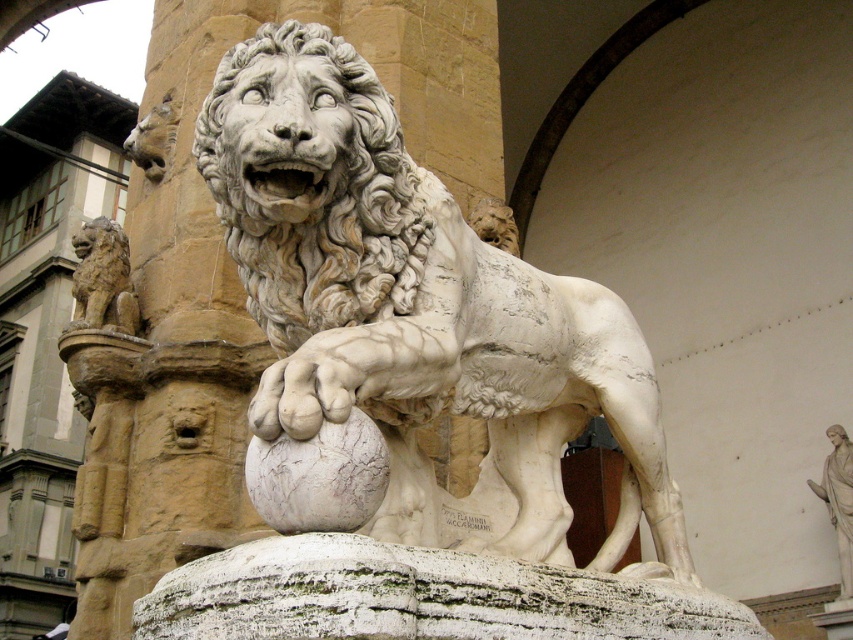
Between white marble lion at center and white marble statue at upper right, which one has less height?

Standing shorter between the two is white marble statue at upper right.

Who is lower down, white marble lion at center or white marble statue at upper right?

white marble statue at upper right is below.

Does point (314, 298) come closer to viewer compared to point (849, 554)?

Yes.

Image resolution: width=853 pixels, height=640 pixels. Find the location of `white marble lion at center`. white marble lion at center is located at coordinates (415, 301).

Who is taller, white marble pillar at center or matte stone lion at left?

white marble pillar at center

Between point (486, 74) and point (126, 323), which one is positioned behind?

Point (486, 74)

Where is `white marble pillar at center`? The image size is (853, 640). white marble pillar at center is located at coordinates (231, 282).

Which is more to the left, white marble lion at center or matte stone lion at left?

From the viewer's perspective, matte stone lion at left appears more on the left side.

Where is `white marble lion at center`? The height and width of the screenshot is (640, 853). white marble lion at center is located at coordinates (415, 301).